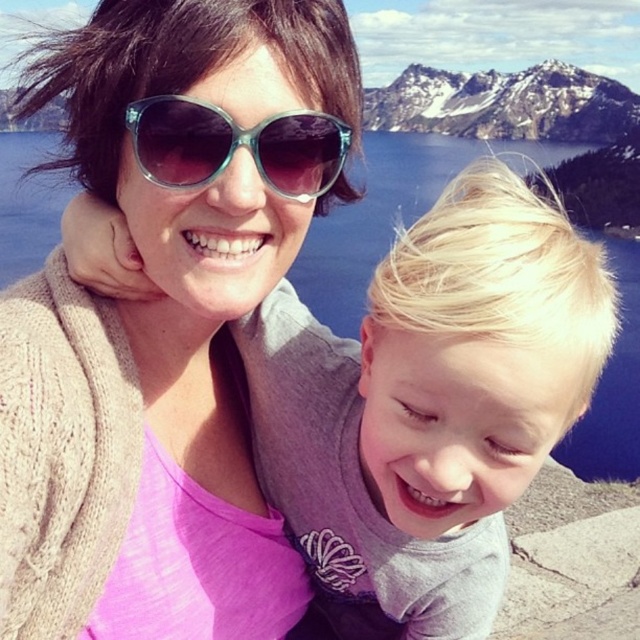
You are standing in front of the scene and want to touch both points. Which point should you reach for first, point (172, 579) or point (252, 150)?

Point (172, 579) is closer to you than point (252, 150), so you should reach for point (172, 579) first.

You are a photographer trying to capture the perfect shot of the two people in the scene. You notice two pairs of sunglasses in the image. The first is matte black sunglasses at upper center and the second is translucent teal sunglasses at center. Which pair is positioned to the left of the other?

The matte black sunglasses at upper center is positioned to the left of the translucent teal sunglasses at center.